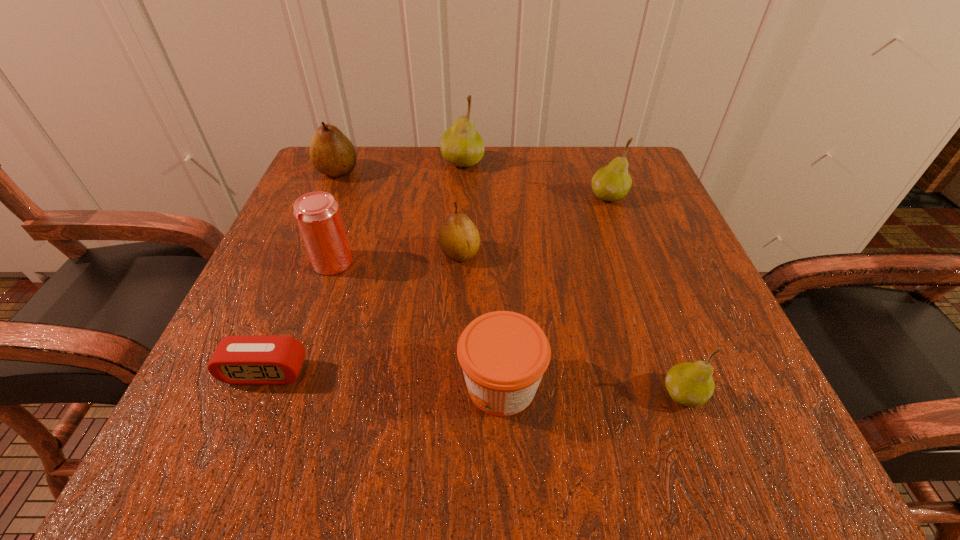
This screenshot has width=960, height=540. In order to click on the farthest green pear in this screenshot , I will do `click(461, 145)`.

Identify the location of the tallest object. (461, 145).

This screenshot has width=960, height=540. What are the coordinates of `the bigger brown pear` in the screenshot? It's located at (331, 152).

Find the location of a particular element. The width and height of the screenshot is (960, 540). the farther brown pear is located at coordinates (331, 152).

Find the location of `the second farthest green pear`. the second farthest green pear is located at coordinates (612, 182).

Locate an element on the screen. the third nearest pear is located at coordinates (612, 182).

Find the location of `beer can`. beer can is located at coordinates (317, 214).

Locate an element on the screen. The height and width of the screenshot is (540, 960). the nearer brown pear is located at coordinates (459, 239).

This screenshot has width=960, height=540. Find the location of `the smaller brown pear`. the smaller brown pear is located at coordinates (459, 239).

Find the location of `the nearest pear`. the nearest pear is located at coordinates (690, 384).